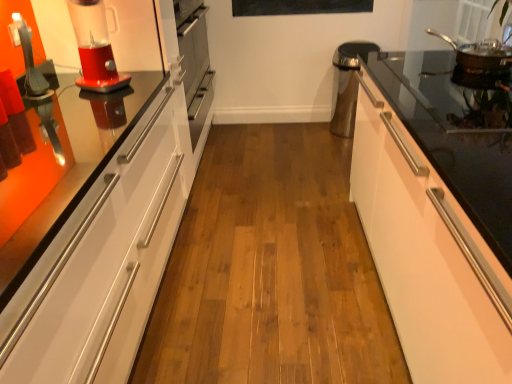
Question: In the image, is stainless steel frying pan at upper right positioned in front of or behind translucent plastic blender at left?

Choices:
 (A) behind
 (B) front

Answer: (A)

Question: Is point (439, 38) positioned closer to the camera than point (83, 72)?

Choices:
 (A) closer
 (B) farther

Answer: (B)

Question: Which object is the farthest from the black matte bulletin board at upper center?

Choices:
 (A) translucent plastic blender at left
 (B) white glossy cabinet at right
 (C) satin silver oven at center
 (D) stainless steel frying pan at upper right

Answer: (B)

Question: Estimate the real-world distances between objects in this image. Which object is farther from the black matte bulletin board at upper center?

Choices:
 (A) satin silver oven at center
 (B) white glossy cabinet at right
 (C) translucent plastic blender at left
 (D) stainless steel frying pan at upper right

Answer: (B)